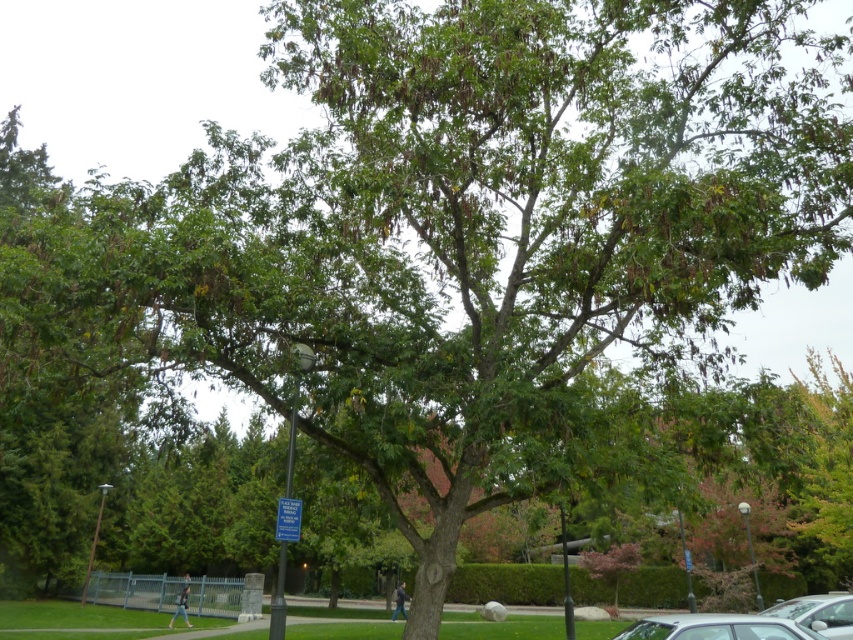
Question: Does silver metallic car at lower center have a larger size compared to silver metallic car at lower right?

Choices:
 (A) no
 (B) yes

Answer: (A)

Question: Does silver metallic car at lower center appear on the right side of silver metallic car at lower right?

Choices:
 (A) no
 (B) yes

Answer: (A)

Question: Can you confirm if silver metallic car at lower center is positioned above silver metallic car at lower right?

Choices:
 (A) yes
 (B) no

Answer: (A)